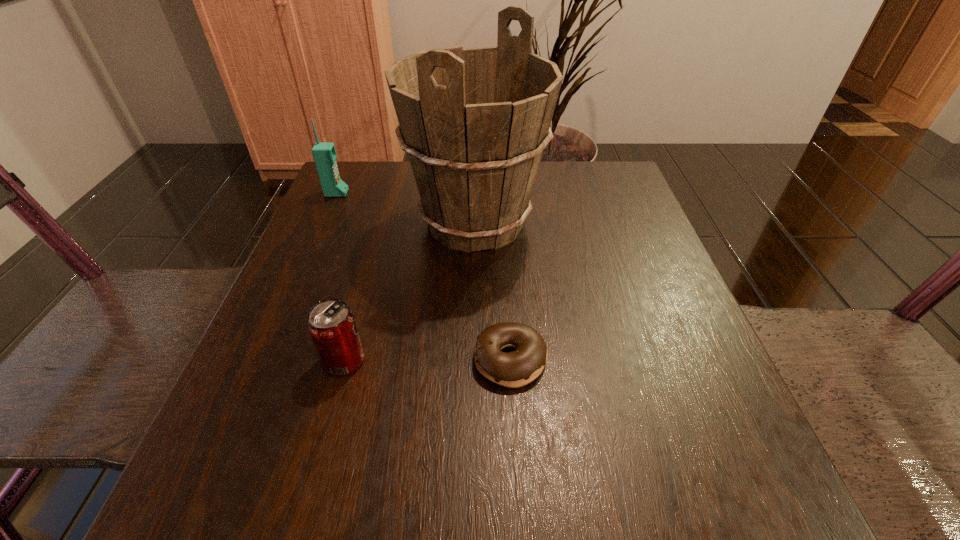
Find the location of a particular element. object that ranks as the third closest to the bucket is located at coordinates coord(331,324).

Find the location of a particular element. The image size is (960, 540). object that can be found as the closest to the bucket is located at coordinates (324, 153).

Locate an element on the screen. free space that satisfies the following two spatial constraints: 1. on the keypad of the leftmost object; 2. on the left side of the shortest object is located at coordinates (264, 360).

Locate an element on the screen. The width and height of the screenshot is (960, 540). blank space that satisfies the following two spatial constraints: 1. on the back side of the bucket; 2. on the keypad of the leftmost object is located at coordinates (475, 193).

This screenshot has width=960, height=540. I want to click on blank space that satisfies the following two spatial constraints: 1. on the back side of the pop soda; 2. on the keypad of the cellular telephone, so click(390, 193).

What are the coordinates of `blank space that satisfies the following two spatial constraints: 1. on the keypad of the third shortest object; 2. on the back side of the doughnut` in the screenshot? It's located at (264, 360).

Where is `blank space that satisfies the following two spatial constraints: 1. on the front side of the doughnut; 2. on the right side of the tallest object`? blank space that satisfies the following two spatial constraints: 1. on the front side of the doughnut; 2. on the right side of the tallest object is located at coordinates (472, 360).

Where is `vacant area in the image that satisfies the following two spatial constraints: 1. on the keypad of the second tallest object; 2. on the left side of the shortest object`? This screenshot has height=540, width=960. vacant area in the image that satisfies the following two spatial constraints: 1. on the keypad of the second tallest object; 2. on the left side of the shortest object is located at coordinates (264, 360).